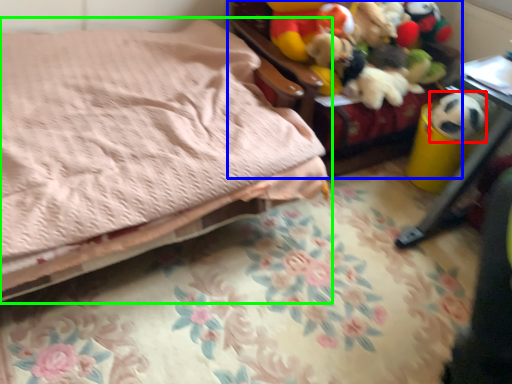
Question: Considering the real-world distances, which object is farthest from animal (highlighted by a red box)? furniture (highlighted by a blue box) or bed (highlighted by a green box)?

Choices:
 (A) furniture
 (B) bed

Answer: (B)